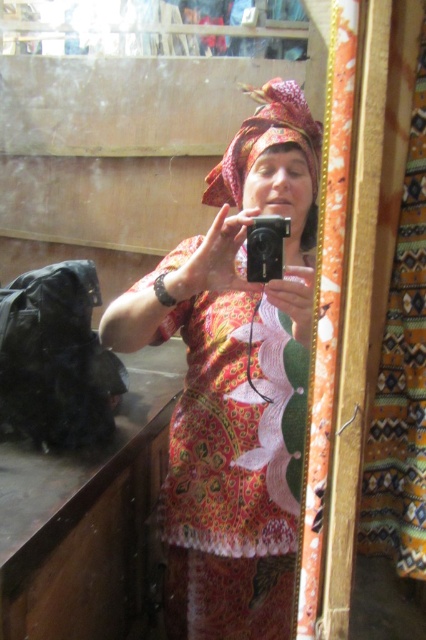
Is printed fabric dress at center shorter than printed fabric shawl at center?

No.

Where is `printed fabric dress at center`? The width and height of the screenshot is (426, 640). printed fabric dress at center is located at coordinates (236, 381).